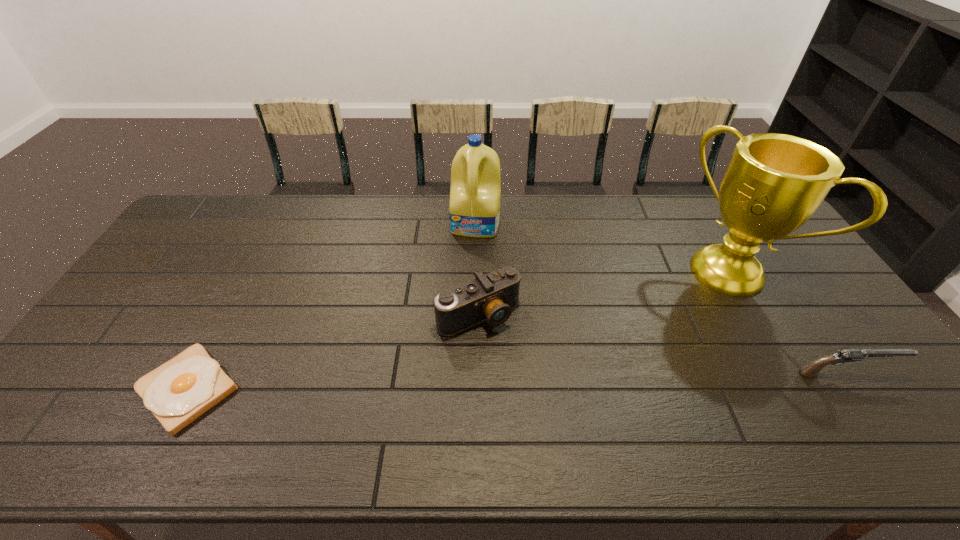
In the image, there is a desktop. At what (x,y) coordinates should I click in order to perform the action: click on blank space at the far edge. Please return your answer as a coordinate pair (x, y). Looking at the image, I should click on (520, 201).

Where is `vacant space at the near edge of the desktop`? vacant space at the near edge of the desktop is located at coordinates click(828, 411).

The width and height of the screenshot is (960, 540). In the image, there is a desktop. Find the location of `free space at the left edge`. free space at the left edge is located at coordinates (132, 377).

The height and width of the screenshot is (540, 960). What are the coordinates of `vacant space at the far right corner of the desktop` in the screenshot? It's located at (713, 194).

In the image, there is a desktop. Where is `free space at the near right corner`? free space at the near right corner is located at coordinates (891, 383).

Locate an element on the screen. The height and width of the screenshot is (540, 960). empty space that is in between the leftmost object and the detergent is located at coordinates (332, 306).

Locate an element on the screen. Image resolution: width=960 pixels, height=540 pixels. empty space that is in between the fourth shortest object and the third tallest object is located at coordinates (477, 269).

Where is `vacant space that's between the camera and the tallest object`? vacant space that's between the camera and the tallest object is located at coordinates (604, 293).

What are the coordinates of `vacant point located between the gun and the toast` in the screenshot? It's located at (517, 381).

Find the location of `free space that is in between the tallest object and the detergent`. free space that is in between the tallest object and the detergent is located at coordinates (603, 248).